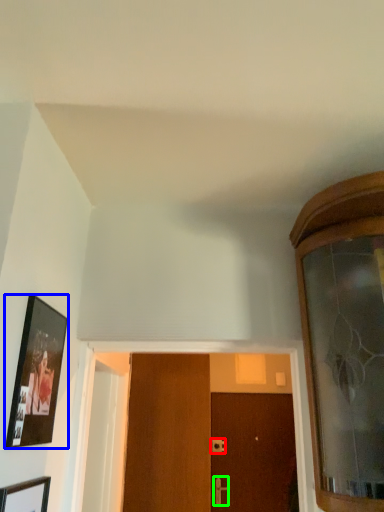
Question: Which object is positioned farthest from door handle (highlighted by a red box)? Select from picture frame (highlighted by a blue box) and door handle (highlighted by a green box).

Choices:
 (A) picture frame
 (B) door handle

Answer: (A)